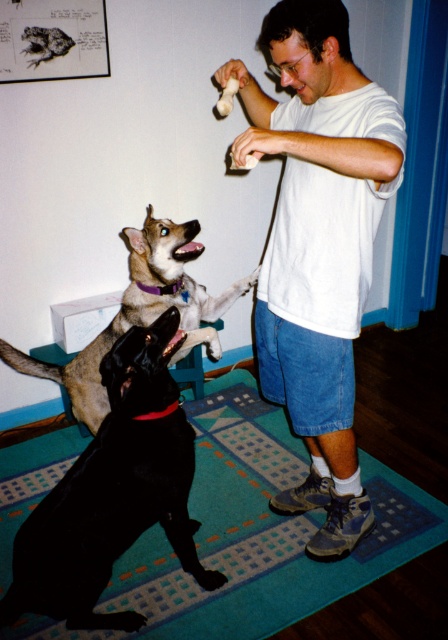
You are a delivery robot trying to reach the front door located at the top of the image. There is a black glossy dog at lower left in your path. Where should you navigate around the dog to reach the door?

Since the black glossy dog at lower left is positioned at coordinates approximately 0.769 on the x axis and 0.254 on the y axis, you should navigate around the dog either to the left or right side to reach the front door at the top of the image.

You are a small robot with a height of 1 meter. You are in the living room and want to move from the teal carpet at lower center to the black glossy dog at lower left. Can you move directly between them without any obstacles?

The teal carpet at lower center is further to the viewer than the black glossy dog at lower left, so there might be a slope or elevation change between them. This could make it difficult for the robot to move directly between them without any obstacles.

Consider the image. You are a photographer trying to capture a clear photo of the black glossy dog at lower left. However, the white cotton shirt at center is blocking your view. Can you adjust your position to see the dog without moving the shirt?

The white cotton shirt at center is positioned over the black glossy dog at lower left, so you can move your camera position lower to see the dog underneath the shirt.